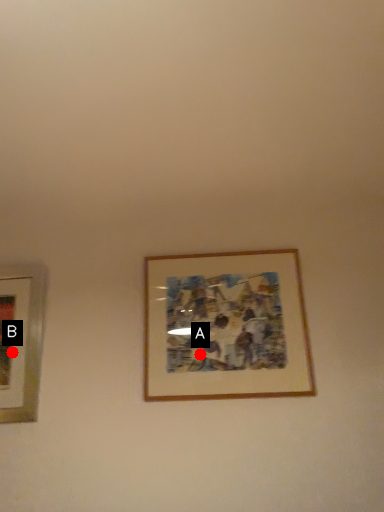
Question: Two points are circled on the image, labeled by A and B beside each circle. Which point is closer to the camera?

Choices:
 (A) A is closer
 (B) B is closer

Answer: (A)